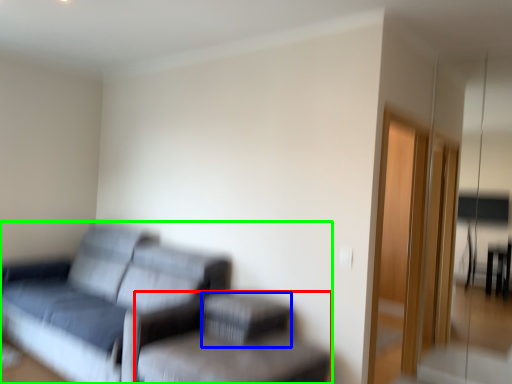
Question: Estimate the real-world distances between objects in this image. Which object is farther from swivel chair (highlighted by a red box), footrest (highlighted by a blue box) or studio couch (highlighted by a green box)?

Choices:
 (A) footrest
 (B) studio couch

Answer: (B)